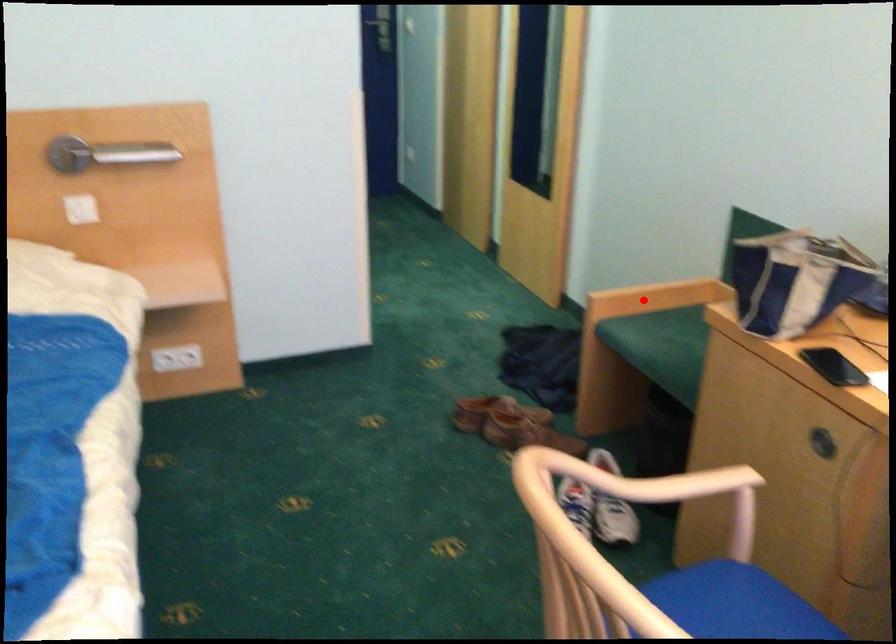
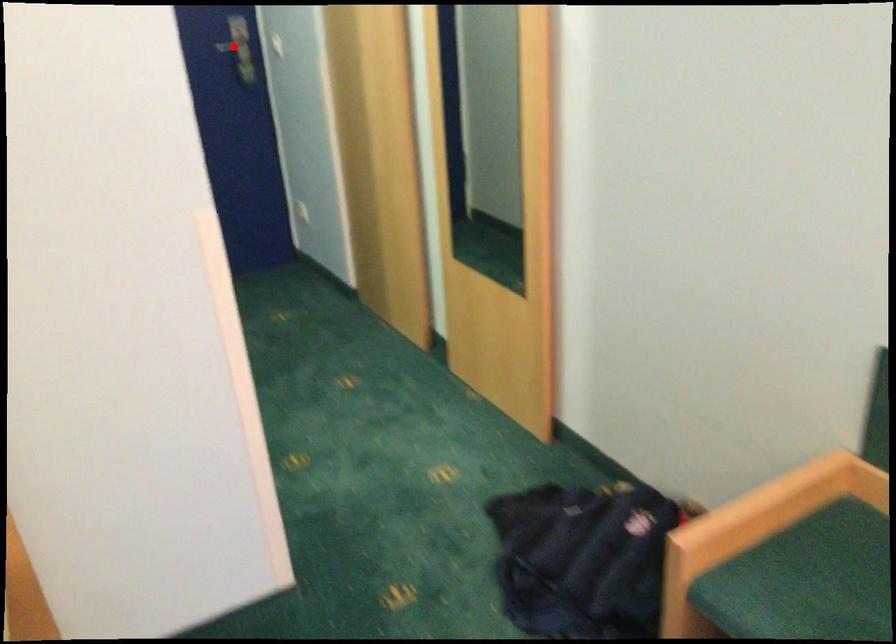
I am providing you with two images of the same scene from different viewpoints. A red point is marked on the first image and another point is marked on the second image. Are the points marked in image1 and image2 representing the same 3D position?

No